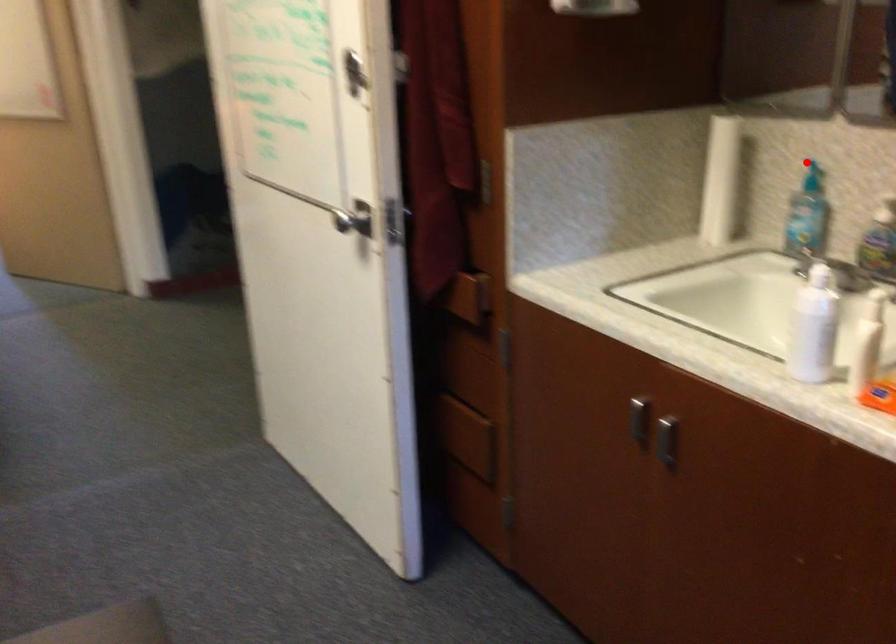
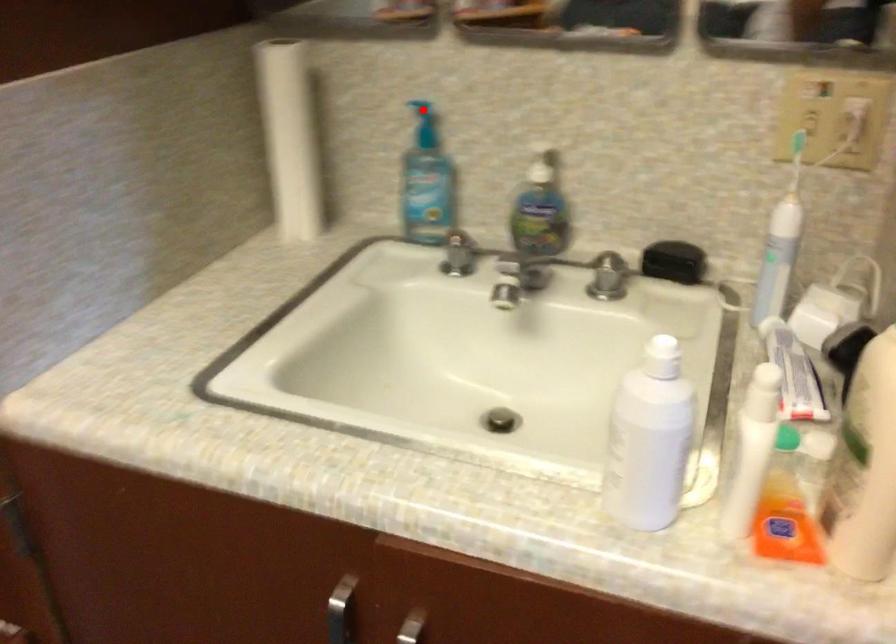
I am providing you with two images of the same scene from different viewpoints. A red point is marked on the first image and another point is marked on the second image. Are the points marked in image1 and image2 representing the same 3D position?

Yes